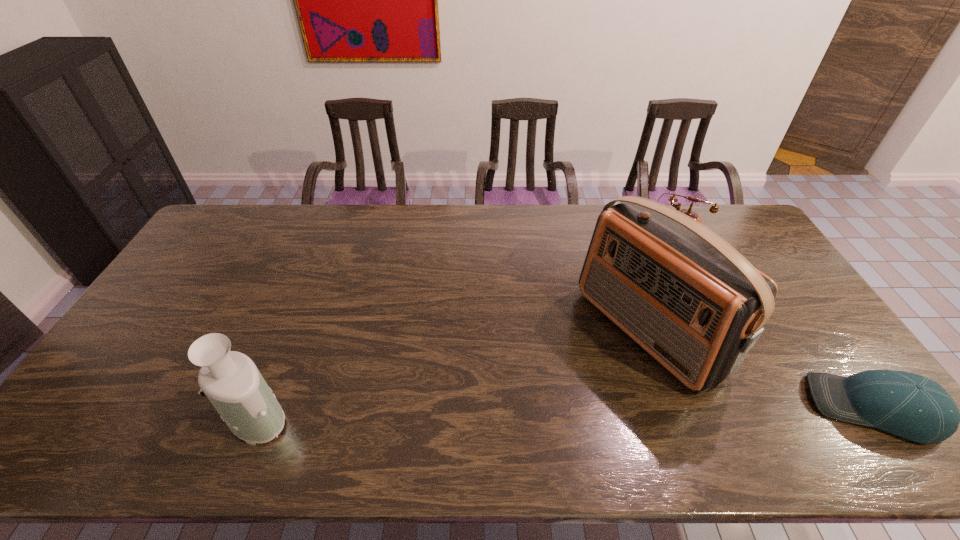
At what (x,y) coordinates should I click in order to perform the action: click on vacant spot on the desktop that is between the second tallest object and the baseball cap and is positioned on the rotary dial of the farthest object. Please return your answer as a coordinate pair (x, y). Looking at the image, I should click on (603, 411).

Find the location of `vacant space on the desktop that is between the leftmost object and the rightmost object and is positioned on the front-facing side of the tallest object`. vacant space on the desktop that is between the leftmost object and the rightmost object and is positioned on the front-facing side of the tallest object is located at coordinates (516, 413).